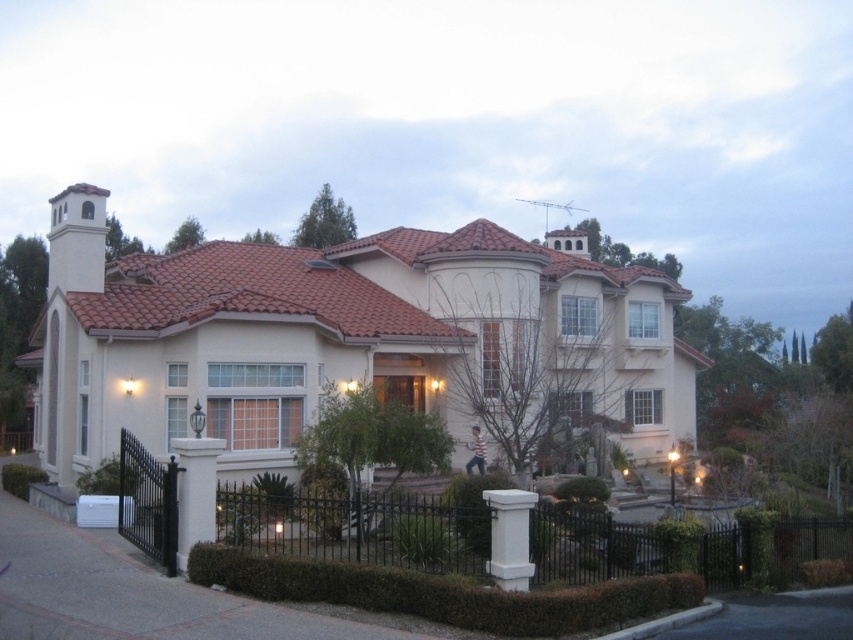
You are standing in front of the house and want to enter through the gate. You see the black wrought iron fence at lower left and the white stone column at center. Which object is closer to the entrance?

The white stone column at center is closer to the entrance because the black wrought iron fence at lower left is to the right of it, meaning the column is positioned more towards the entrance area.

You are standing in front of the house and want to walk towards the white stucco mansion at center and the white stone column at center. Which object will you reach first?

You will reach the white stucco mansion at center first because it is closer to you than the white stone column at center.

You are a delivery person standing at the front gate of the property. You need to deliver a package to the white stucco mansion at center. There is a white stone column at center blocking the path. Can you walk around the column to reach the mansion?

The white stucco mansion at center is 8.75 meters away from the white stone column at center. Since the column is between you and the mansion, you can walk around it as there is enough space to maneuver around the column to reach the mansion.